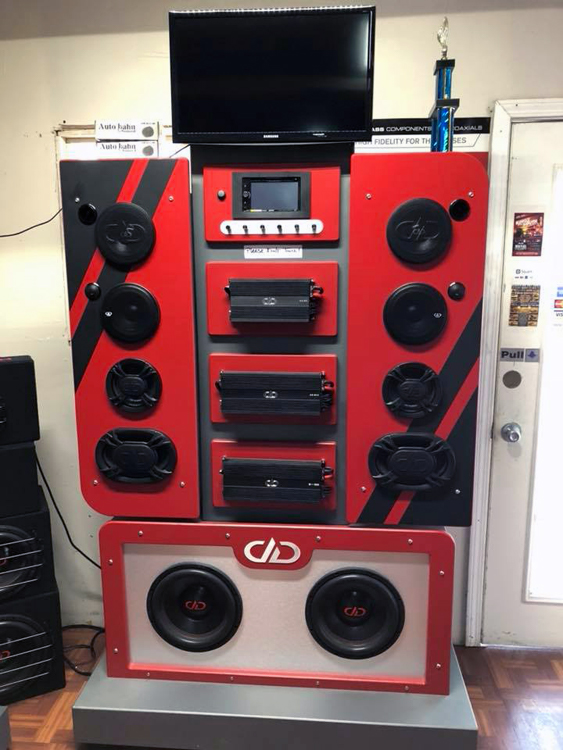
Locate an element on the screen. The height and width of the screenshot is (750, 563). speaker is located at coordinates (210, 609), (365, 610).